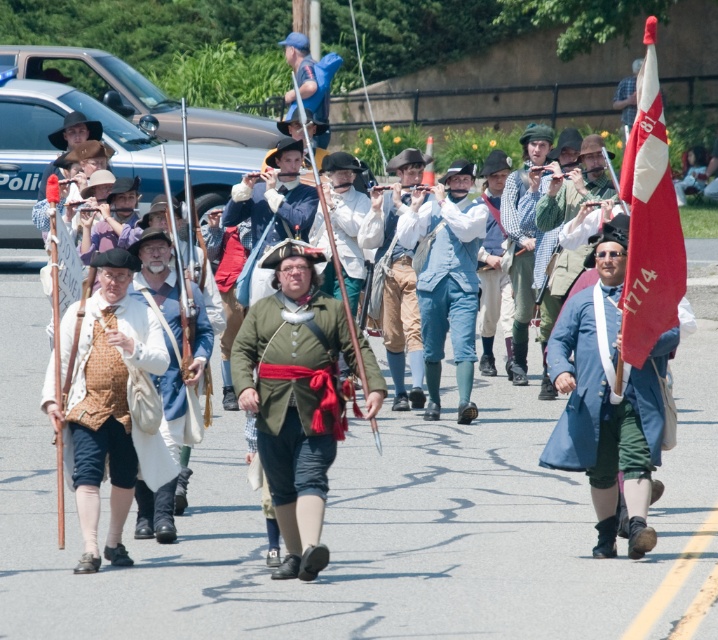
Based on the photo, between blue fabric coat at center and red fabric flag at right, which one appears on the right side from the viewer's perspective?

Positioned to the right is red fabric flag at right.

Locate an element on the screen. blue fabric coat at center is located at coordinates (607, 397).

Who is higher up, red fabric flag at right or checkered fabric shirt at center?

red fabric flag at right is above.

Can you confirm if red fabric flag at right is positioned to the right of checkered fabric shirt at center?

Correct, you'll find red fabric flag at right to the right of checkered fabric shirt at center.

This screenshot has width=718, height=640. I want to click on red fabric flag at right, so [648, 221].

Looking at this image, can you confirm if matte brown vest at center is shorter than red fabric flag at right?

Indeed, matte brown vest at center has a lesser height compared to red fabric flag at right.

Where is `matte brown vest at center`? This screenshot has height=640, width=718. matte brown vest at center is located at coordinates (108, 404).